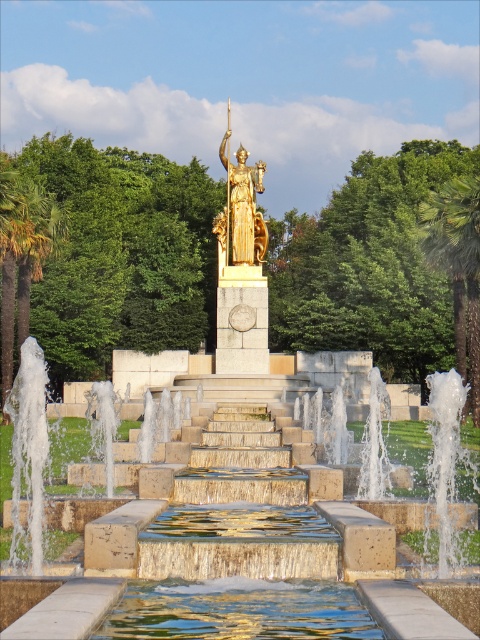
Is clear glass water at center thinner than green leafy palm tree at left?

Indeed, clear glass water at center has a lesser width compared to green leafy palm tree at left.

Does clear glass water at center appear on the right side of green leafy palm tree at left?

Indeed, clear glass water at center is positioned on the right side of green leafy palm tree at left.

Who is more distant from viewer, (117, 621) or (0, 180)?

Positioned behind is point (0, 180).

Image resolution: width=480 pixels, height=640 pixels. I want to click on clear glass water at center, so click(239, 611).

You are a GUI agent. You are given a task and a screenshot of the screen. Output one action in this format:
    pyautogui.click(x=<x>, y=<y>)
    Task: Click on the clear glass water at center
    This screenshot has width=480, height=640.
    Given the screenshot: What is the action you would take?
    pyautogui.click(x=239, y=611)

Does point (238, 611) come behind point (232, 209)?

No, it is in front of (232, 209).

Which is in front, point (300, 604) or point (222, 237)?

Positioned in front is point (300, 604).

At what (x,y) coordinates should I click in order to perform the action: click on clear glass water at center. Please return your answer as a coordinate pair (x, y). Looking at the image, I should click on (239, 611).

Does clear glass water at center have a greater width compared to green leafy palm tree at right?

No, clear glass water at center is not wider than green leafy palm tree at right.

Consider the image. Can you confirm if clear glass water at center is shorter than green leafy palm tree at right?

Indeed, clear glass water at center has a lesser height compared to green leafy palm tree at right.

Does point (313, 616) lie in front of point (478, 246)?

Yes.

Identify the location of clear glass water at center. (239, 611).